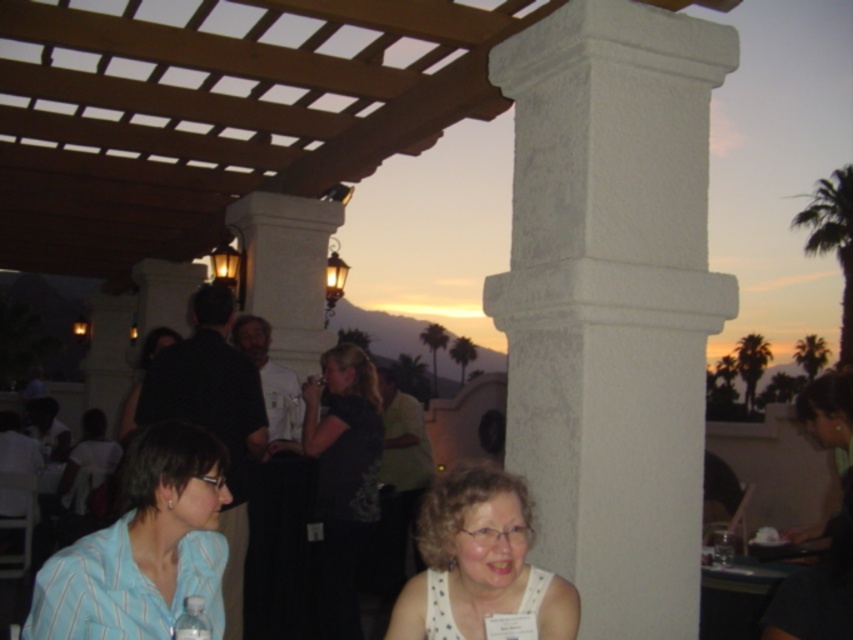
You are a photographer at the event and want to ensure both the black matte shirt at center and the dark fabric dress at center are clearly visible in your photo. Given their sizes, which one might you need to adjust your focus on to capture more detail?

The black matte shirt at center is larger in size than the dark fabric dress at center, so you might need to adjust focus on the dark fabric dress at center to ensure its details are captured clearly since it is smaller.

You are organizing a photo shoot and need to ensure that the blue striped shirt at lower left and the white dotted tank top at lower center are both visible in the frame. Given their sizes, which one might require more careful positioning to avoid being overshadowed?

The blue striped shirt at lower left occupies less space than the white dotted tank top at lower center, so the blue striped shirt at lower left might require more careful positioning to avoid being overshadowed by the larger white dotted tank top at lower center.